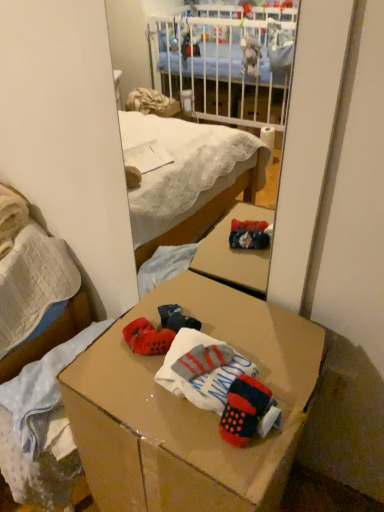
Question: Is knitted wool socks at center facing towards matte cardboard box at lower center?

Choices:
 (A) yes
 (B) no

Answer: (B)

Question: Are knitted wool socks at center and matte cardboard box at lower center far apart?

Choices:
 (A) yes
 (B) no

Answer: (B)

Question: Does knitted wool socks at center have a smaller size compared to matte cardboard box at lower center?

Choices:
 (A) no
 (B) yes

Answer: (B)

Question: Considering the relative sizes of knitted wool socks at center and matte cardboard box at lower center in the image provided, is knitted wool socks at center thinner than matte cardboard box at lower center?

Choices:
 (A) yes
 (B) no

Answer: (A)

Question: From the image's perspective, is knitted wool socks at center located beneath matte cardboard box at lower center?

Choices:
 (A) yes
 (B) no

Answer: (B)

Question: Considering the relative positions of knitted wool socks at center and matte cardboard box at lower center in the image provided, is knitted wool socks at center to the right of matte cardboard box at lower center from the viewer's perspective?

Choices:
 (A) yes
 (B) no

Answer: (A)

Question: Does knitted wool socks at center have a smaller size compared to cardboard box at center?

Choices:
 (A) yes
 (B) no

Answer: (A)

Question: Does knitted wool socks at center have a larger size compared to cardboard box at center?

Choices:
 (A) yes
 (B) no

Answer: (B)

Question: From the image's perspective, is knitted wool socks at center beneath cardboard box at center?

Choices:
 (A) no
 (B) yes

Answer: (A)

Question: Is cardboard box at center surrounded by knitted wool socks at center?

Choices:
 (A) no
 (B) yes

Answer: (A)

Question: Is knitted wool socks at center beside cardboard box at center?

Choices:
 (A) no
 (B) yes

Answer: (A)

Question: Does knitted wool socks at center turn towards cardboard box at center?

Choices:
 (A) yes
 (B) no

Answer: (A)

Question: Is cardboard box at center thinner than knitted wool socks at center?

Choices:
 (A) no
 (B) yes

Answer: (A)